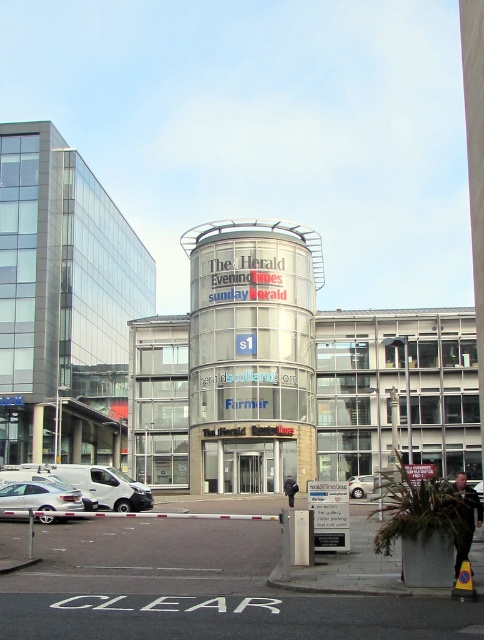
You are a delivery driver approaching the cylindrical building with the signage. You need to park your vehicle between the silver metallic sedan at lower left and the silver metallic car at center. Is there enough space between them to park your van, which is 2 meters wide?

The silver metallic sedan at lower left is to the left of the silver metallic car at center. Since the distance between them is not specified, it is uncertain if there is enough space for the van. Please check the actual distance before deciding.

You are a delivery driver who needs to park your silver metallic car at lower left near the cylindrical building. The parking spot you want is 30 meters long. Can your car fit in the parking spot?

The distance between the silver metallic car at lower left and the cylindrical building is 31.92 meters, so the parking spot is 30 meters long, which is shorter than the distance between them. Therefore, the car cannot fit in the parking spot.